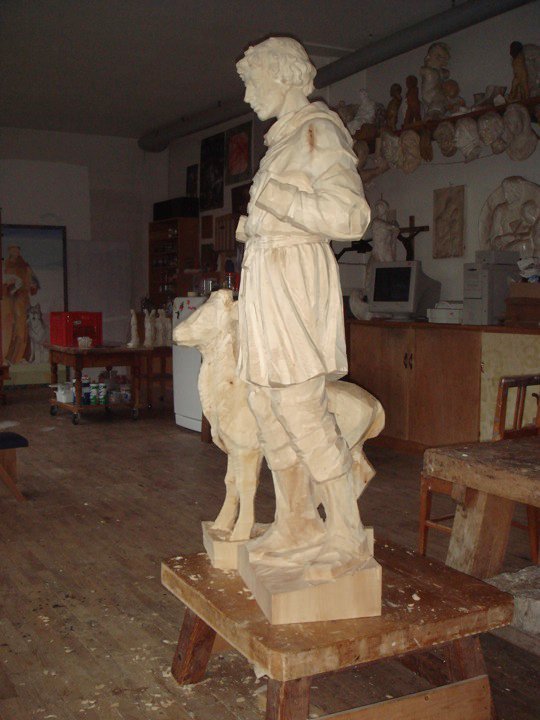
I want to click on crucifix, so click(x=411, y=240).